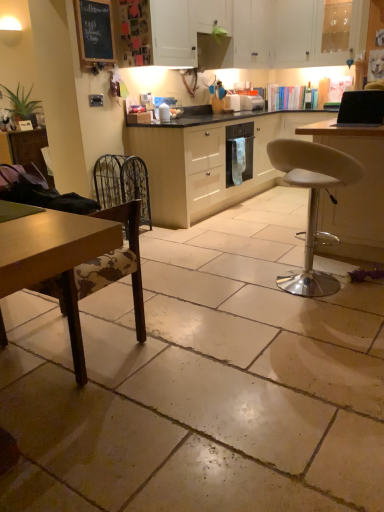
Locate an element on the screen. free location to the left of white plastic table at right is located at coordinates (243, 254).